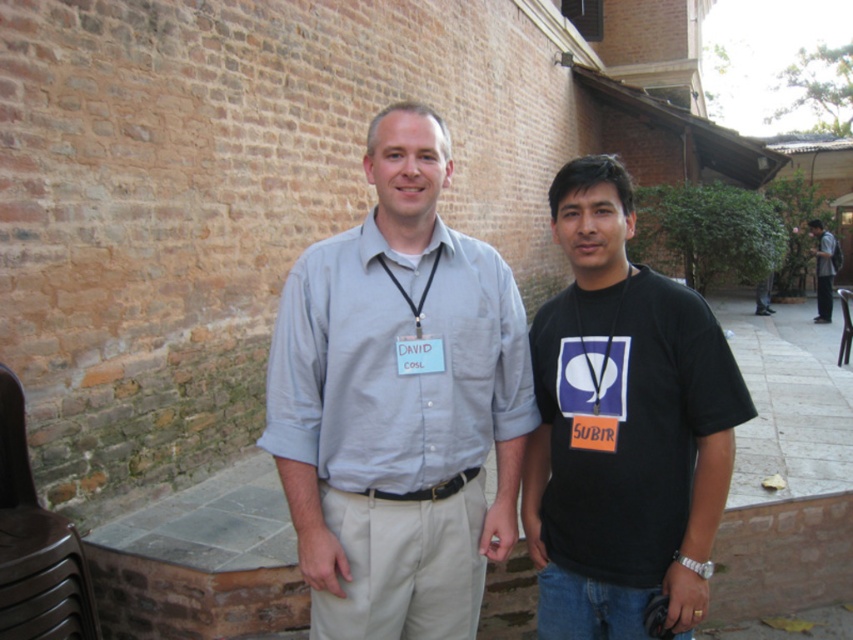
You are standing in front of the brick wall where David and Subir are standing. There is a point at coordinate (x=402, y=602) that you need to reach. If you can move 7 feet in one step, how many steps do you need to take to reach that point?

The point at coordinate (x=402, y=602) is 7.52 feet away from the viewer. Since you can move 7 feet in one step, you would need to take 2 steps to reach it, as 7.52 divided by 7 is approximately 1.07, meaning one full step covers most of the distance but a second step is needed to fully reach the point.